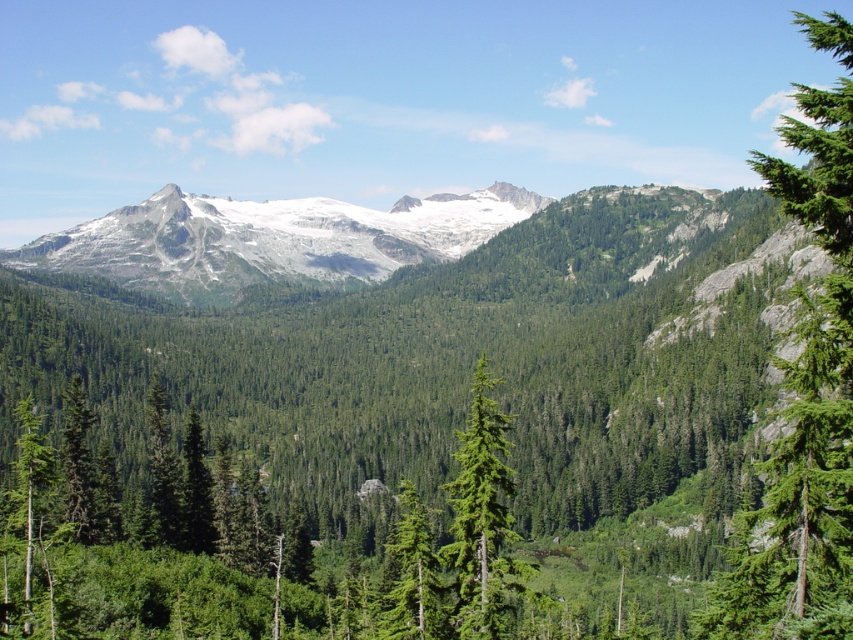
Is point (173, 224) more distant than point (488, 637)?

Yes, point (173, 224) is behind point (488, 637).

Does white rocky mountain range at center have a lesser width compared to green needle-like tree at center?

No, white rocky mountain range at center is not thinner than green needle-like tree at center.

Does point (189, 211) come farther from viewer compared to point (488, 403)?

Yes.

Identify the location of white rocky mountain range at center. (270, 240).

Between green textured tree at right and green matte tree at center, which one has more height?

green textured tree at right

Which is more to the left, green textured tree at right or green matte tree at center?

Positioned to the left is green matte tree at center.

Which is behind, point (763, 563) or point (390, 600)?

The point (390, 600) is more distant.

I want to click on green textured tree at right, so click(x=805, y=396).

From the picture: Is green textured tree at right above white rocky mountain range at center?

Yes, green textured tree at right is above white rocky mountain range at center.

Which is below, green textured tree at right or white rocky mountain range at center?

white rocky mountain range at center is lower down.

Is point (756, 157) positioned behind point (361, 248)?

Yes, it is behind point (361, 248).

This screenshot has height=640, width=853. I want to click on green textured tree at right, so click(x=805, y=396).